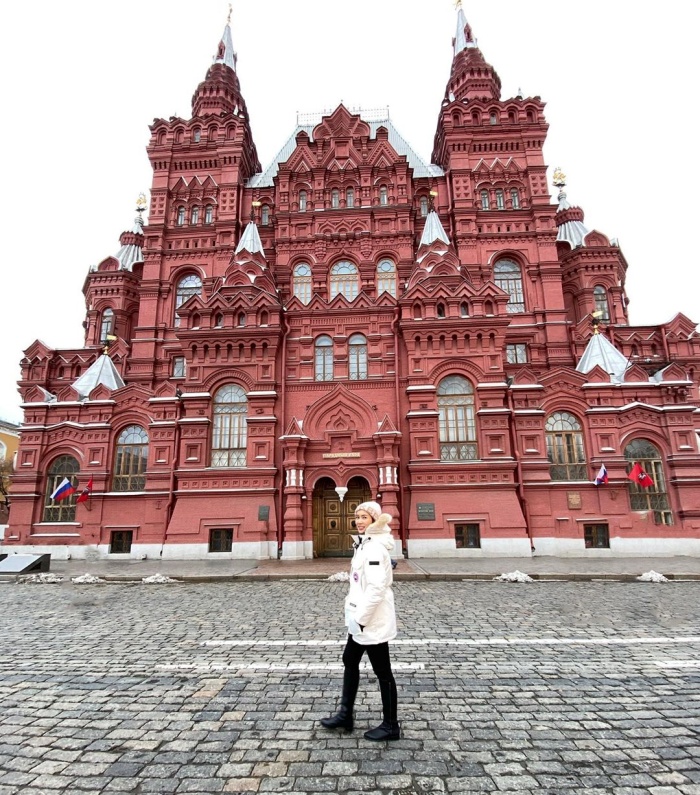
The image size is (700, 795). I want to click on shoe, so click(332, 719), click(382, 731).